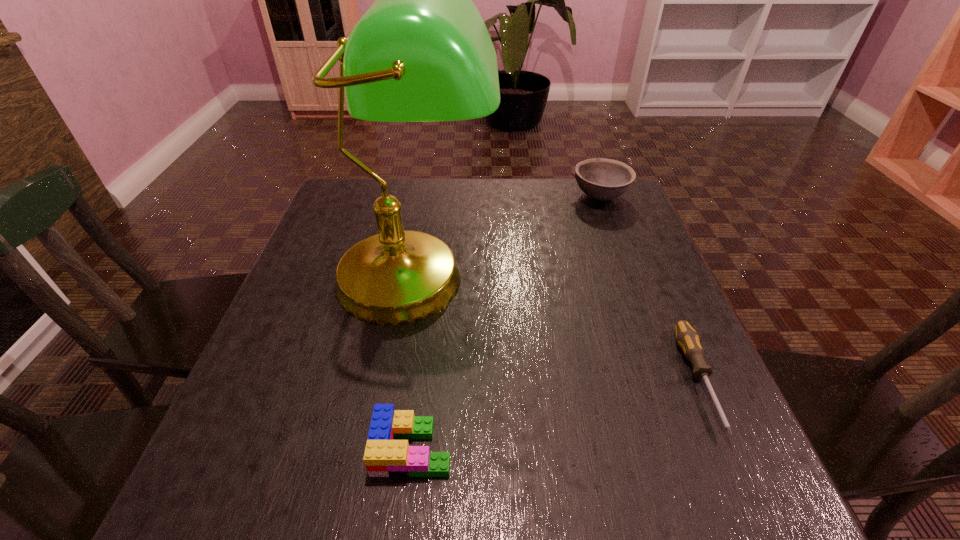
The image size is (960, 540). Find the location of `object that is at the near edge`. object that is at the near edge is located at coordinates (384, 456).

Locate an element on the screen. object located at the left edge is located at coordinates (421, 53).

Where is `bowl that is at the right edge`? bowl that is at the right edge is located at coordinates pyautogui.click(x=602, y=179).

The width and height of the screenshot is (960, 540). I want to click on screwdriver that is at the right edge, so click(x=687, y=338).

The width and height of the screenshot is (960, 540). In order to click on object located in the far right corner section of the desktop in this screenshot , I will do `click(602, 179)`.

The height and width of the screenshot is (540, 960). Find the location of `vacant space at the far edge of the desktop`. vacant space at the far edge of the desktop is located at coordinates (533, 198).

The height and width of the screenshot is (540, 960). I want to click on vacant space at the left edge of the desktop, so click(288, 293).

You are a GUI agent. You are given a task and a screenshot of the screen. Output one action in this format:
    pyautogui.click(x=<x>, y=<y>)
    Task: Click on the free point at the right edge
    Image resolution: width=960 pixels, height=540 pixels.
    Given the screenshot: What is the action you would take?
    pyautogui.click(x=652, y=445)

This screenshot has height=540, width=960. I want to click on vacant space at the far left corner of the desktop, so click(x=365, y=224).

At what (x,y) coordinates should I click in order to perform the action: click on vacant region at the far right corner of the desktop. Please return your answer as a coordinate pair (x, y). The width and height of the screenshot is (960, 540). Looking at the image, I should click on (587, 211).